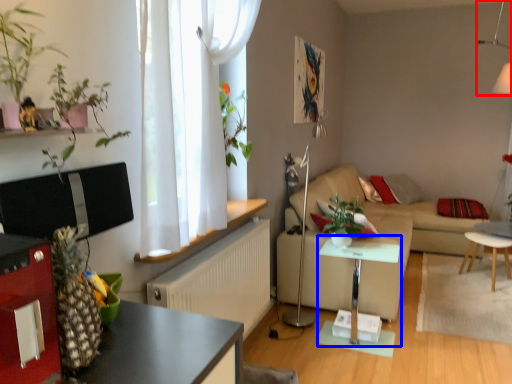
Question: Which object is further to the camera taking this photo, lamp (highlighted by a red box) or table (highlighted by a blue box)?

Choices:
 (A) lamp
 (B) table

Answer: (A)